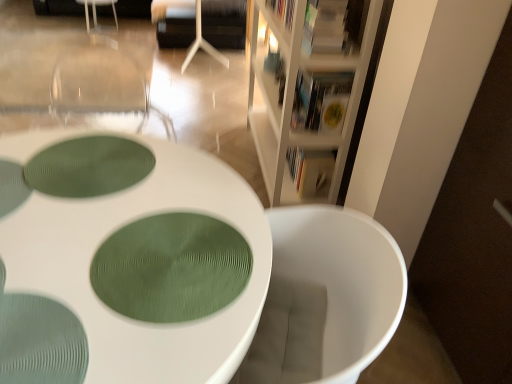
This screenshot has height=384, width=512. I want to click on blank space above green textured oval at center, which ranks as the second oval in top-to-bottom order (from a real-world perspective), so click(x=175, y=264).